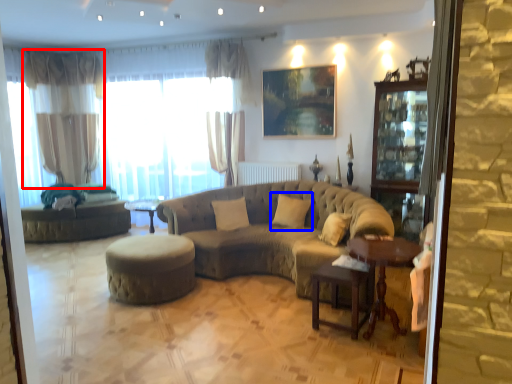
Question: Which of the following is the farthest to the observer, curtain (highlighted by a red box) or pillow (highlighted by a blue box)?

Choices:
 (A) curtain
 (B) pillow

Answer: (A)